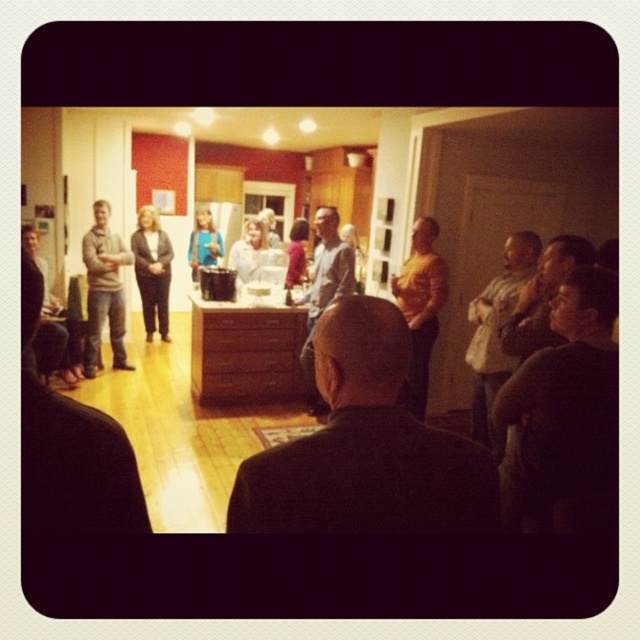
Question: Is wooden table at center further to the viewer compared to orange shirt at center?

Choices:
 (A) no
 (B) yes

Answer: (A)

Question: Which point appears closest to the camera in this image?

Choices:
 (A) (44, 314)
 (B) (429, 417)

Answer: (A)

Question: Which object is farther from the camera taking this photo?

Choices:
 (A) orange shirt at center
 (B) dark brown suit at center
 (C) white shirt at center
 (D) wooden table at center

Answer: (C)

Question: Is wooden table at center positioned before orange shirt at center?

Choices:
 (A) no
 (B) yes

Answer: (B)

Question: Can you confirm if light brown sweater at left is thinner than light brown leather jacket at center?

Choices:
 (A) yes
 (B) no

Answer: (A)

Question: Which is farther from the light brown sweater at left?

Choices:
 (A) dark brown leather jacket at lower right
 (B) light brown leather jacket at right
 (C) dark gray shirt at lower right
 (D) wooden table at center

Answer: (D)